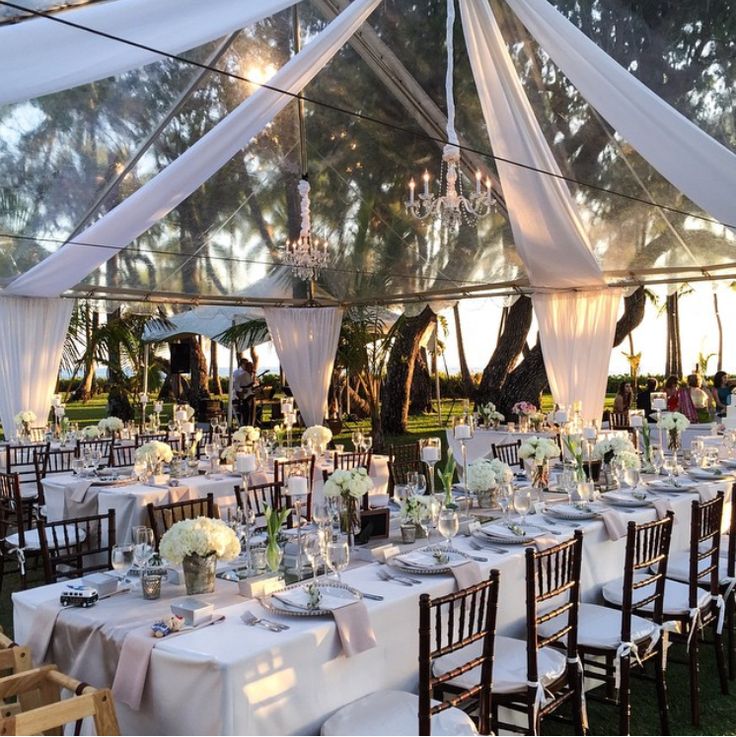
The width and height of the screenshot is (736, 737). In order to click on seats of chairs in this screenshot , I will do `click(723, 544)`, `click(675, 562)`, `click(673, 590)`, `click(601, 621)`, `click(508, 666)`, `click(389, 716)`, `click(35, 539)`, `click(28, 489)`.